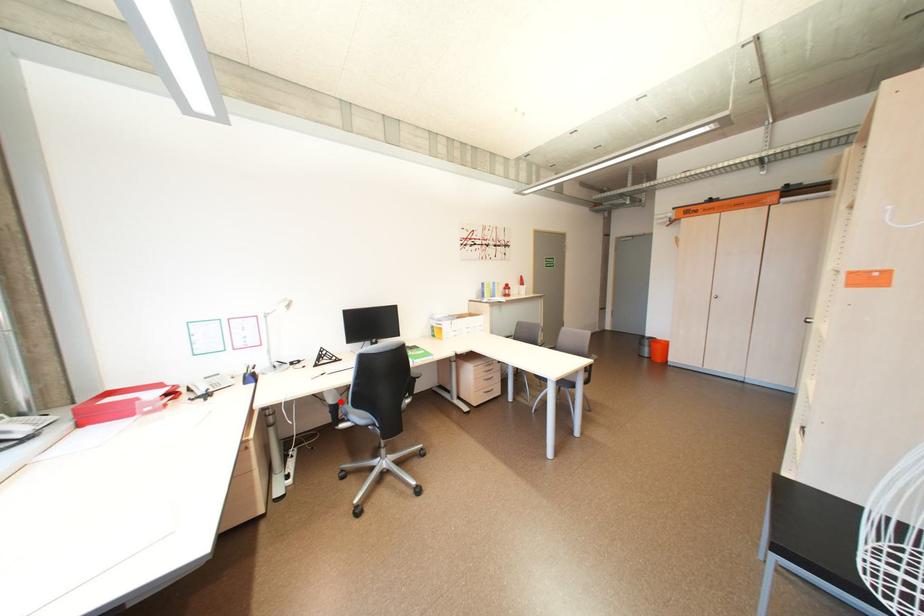
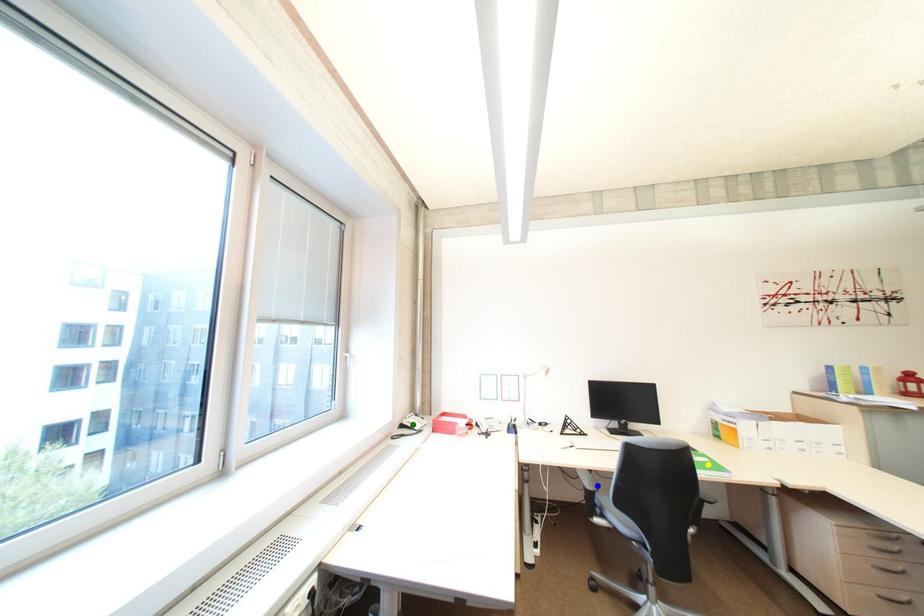
Question: I am providing you with two images of the same scene from different viewpoints. A red point is marked on the first image. You are given multiple points on the second image. Can you choose the point in image 2 that corresponds to the point in image 1?

Choices:
 (A) yellow point
 (B) green point
 (C) blue point

Answer: (C)